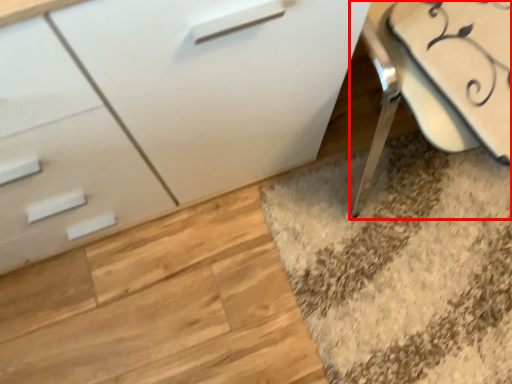
Question: Observing the image, what is the correct spatial positioning of swivel chair (annotated by the red box) in reference to chest of drawers?

Choices:
 (A) right
 (B) left

Answer: (A)